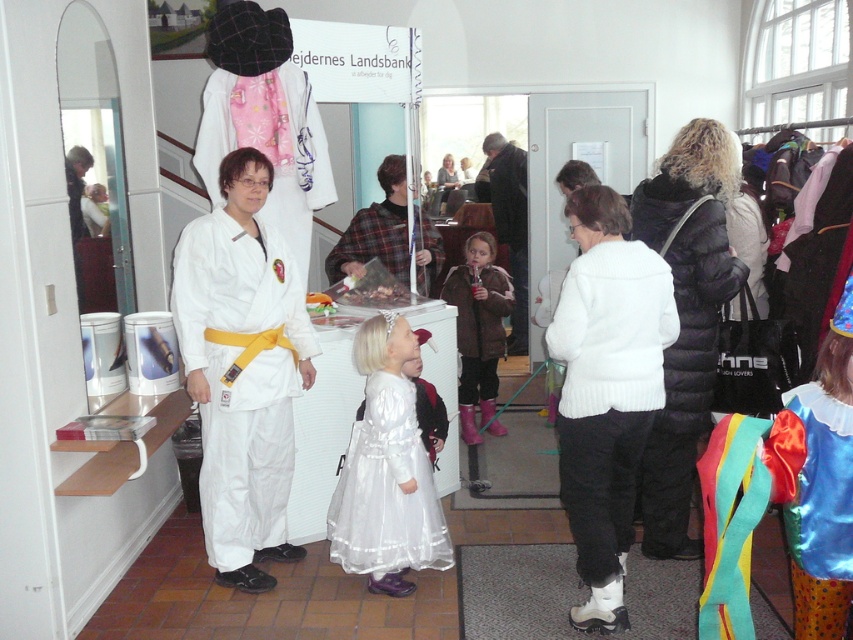
Consider the image. You are organizing a photoshoot and need to arrange two outfits for a model. The outfits are the silky blue dress at center and the brown fuzzy jacket at center. Based on the scene description, which outfit is positioned lower on the model?

The silky blue dress at center is positioned lower on the model because it is described as being below the brown fuzzy jacket at center.

You are organizing a fashion show and need to arrange two models wearing the white satin dress at center and the plaid fabric shirt at center side by side on a runway. Based on their widths, which model should stand closer to the edge of the runway to ensure both fit comfortably?

The white satin dress at center is narrower than the plaid fabric shirt at center. To ensure both fit comfortably on the runway, the model wearing the white satin dress at center should stand closer to the edge since it requires less space.

You are organizing a photo shoot in the community center and need to place a camera stand at the center of the room. There is a white knitted sweater at center. Where should you position the camera stand to avoid blocking the sweater?

The white knitted sweater at center is located at point (606, 388), so you should position the camera stand away from that coordinate to avoid blocking it.